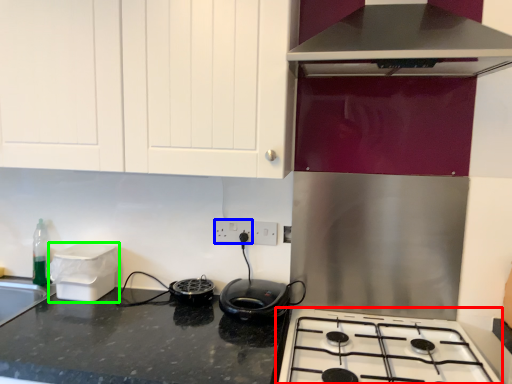
Question: Which object is the closest to the gas stove (highlighted by a red box)? Choose among these: electric outlet (highlighted by a blue box) or appliance (highlighted by a green box).

Choices:
 (A) electric outlet
 (B) appliance

Answer: (A)